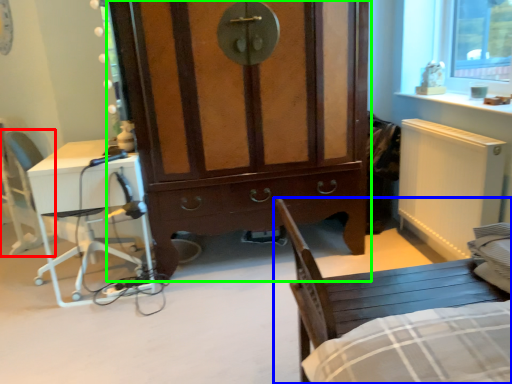
Question: Considering the real-world distances, which object is closest to armchair (highlighted by a red box)? chair (highlighted by a blue box) or cabinetry (highlighted by a green box).

Choices:
 (A) chair
 (B) cabinetry

Answer: (B)